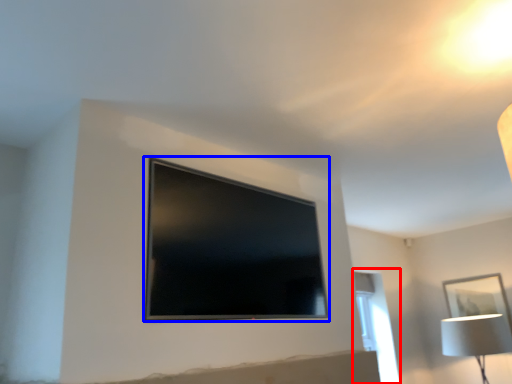
Question: Which object is further to the camera taking this photo, window (highlighted by a red box) or television (highlighted by a blue box)?

Choices:
 (A) window
 (B) television

Answer: (A)